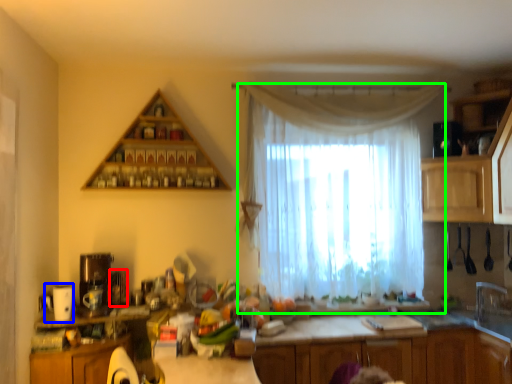
Question: Which is nearer to the appliance (highlighted by a red box)? appliance (highlighted by a blue box) or curtain (highlighted by a green box).

Choices:
 (A) appliance
 (B) curtain

Answer: (A)